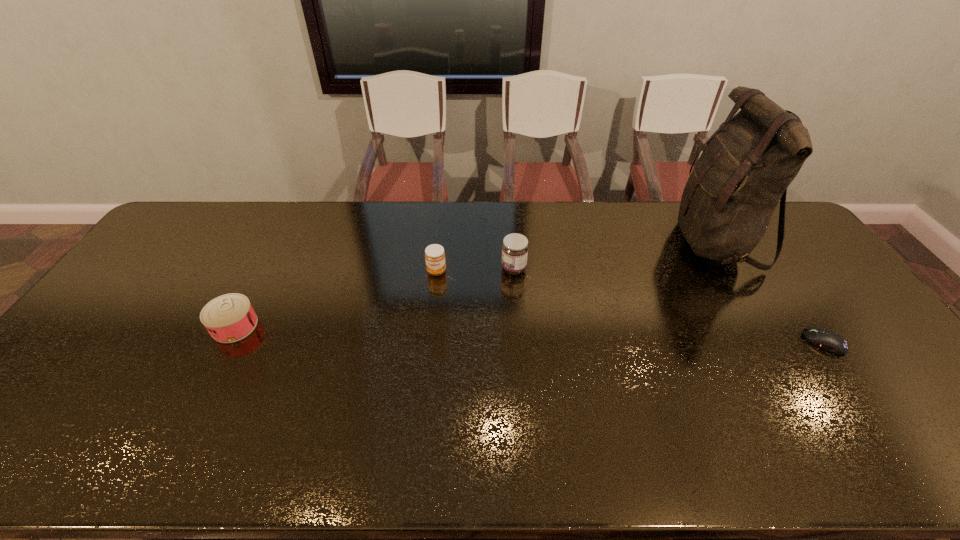
Where is `free space between the left jam and the backpack`? The height and width of the screenshot is (540, 960). free space between the left jam and the backpack is located at coordinates (575, 256).

Locate an element on the screen. This screenshot has width=960, height=540. vacant point located between the left jam and the leftmost object is located at coordinates (335, 299).

The image size is (960, 540). I want to click on free spot between the right jam and the leftmost object, so click(x=374, y=297).

Identify the location of empty space that is in between the shortest object and the backpack. The width and height of the screenshot is (960, 540). (769, 292).

This screenshot has height=540, width=960. In order to click on vacant space that's between the left jam and the second shortest object in this screenshot , I will do `click(335, 299)`.

Where is `the second closest object relative to the backpack`? the second closest object relative to the backpack is located at coordinates (515, 247).

You are a GUI agent. You are given a task and a screenshot of the screen. Output one action in this format:
    pyautogui.click(x=<x>, y=<y>)
    Task: Click on the object that is the second nearest to the backpack
    This screenshot has height=540, width=960.
    Given the screenshot: What is the action you would take?
    pyautogui.click(x=515, y=247)

This screenshot has height=540, width=960. Find the location of `free space that satisfies the following two spatial constraints: 1. on the open flap of the tallest object; 2. on the front label of the third shortest object`. free space that satisfies the following two spatial constraints: 1. on the open flap of the tallest object; 2. on the front label of the third shortest object is located at coordinates (732, 271).

I want to click on vacant space that satisfies the following two spatial constraints: 1. on the open flap of the backpack; 2. on the left side of the computer equipment, so click(775, 342).

Find the location of `vacant area in the image that satisfies the following two spatial constraints: 1. on the front label of the shortest object; 2. on the left side of the second tallest object`. vacant area in the image that satisfies the following two spatial constraints: 1. on the front label of the shortest object; 2. on the left side of the second tallest object is located at coordinates (519, 342).